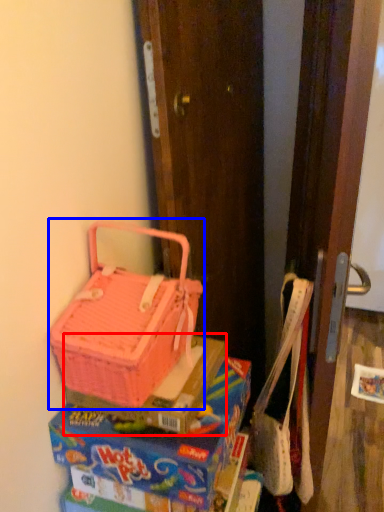
Question: Which of the following is the farthest to the observer, box (highlighted by a red box) or picnic basket (highlighted by a blue box)?

Choices:
 (A) box
 (B) picnic basket

Answer: (A)